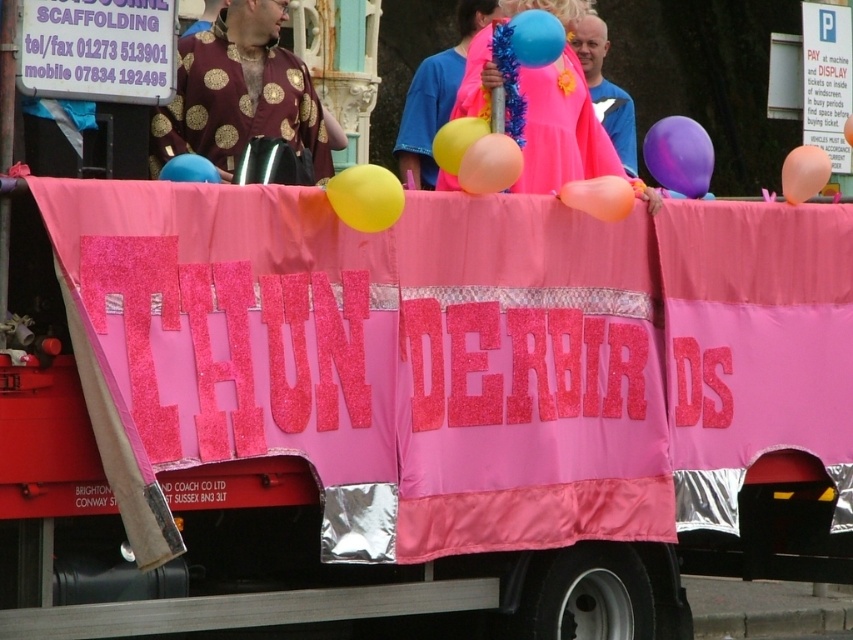
Question: Which of the following is the farthest from the observer?

Choices:
 (A) neon pink fabric at upper center
 (B) purple glossy balloon at upper right
 (C) maroon velvet robe at upper center
 (D) pink fabric banner at center

Answer: (A)

Question: Is blue shiny balloon at upper center to the right of yellow rubber balloon at center from the viewer's perspective?

Choices:
 (A) yes
 (B) no

Answer: (A)

Question: Estimate the real-world distances between objects in this image. Which object is closer to the matte blue balloon at upper center?

Choices:
 (A) rubber balloon at center
 (B) blue shiny balloon at upper center

Answer: (A)

Question: Can you confirm if pink fabric banner at center is smaller than rubber balloon at center?

Choices:
 (A) yes
 (B) no

Answer: (B)

Question: From the image, what is the correct spatial relationship of blue shiny balloon at upper center in relation to yellow rubber balloon at center?

Choices:
 (A) below
 (B) above

Answer: (B)

Question: Which point is closer to the camera taking this photo?

Choices:
 (A) (805, 164)
 (B) (463, 148)
 (C) (316, 125)

Answer: (B)